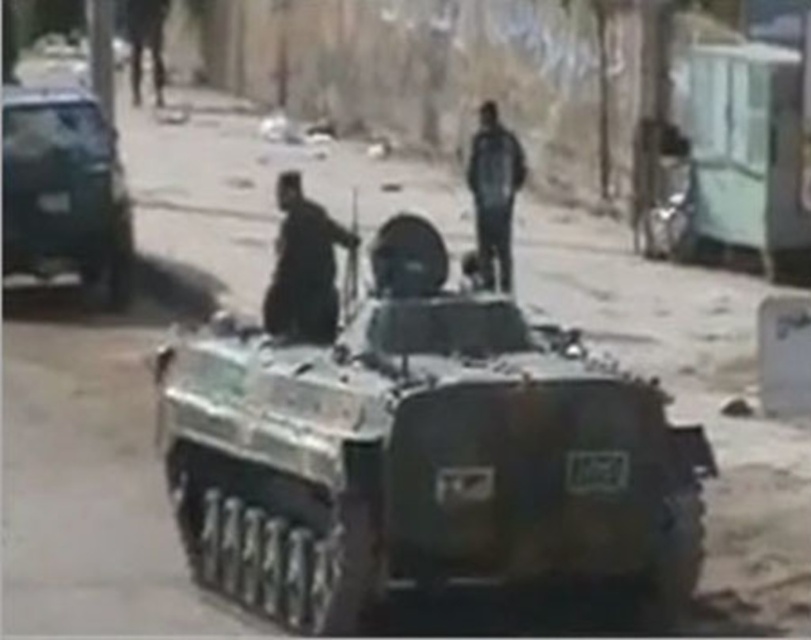
You are a pedestrian trying to cross the street where the shiny black car at left and the dark blue fabric jacket at center are located. Based on their positions, which object is closer to you as you approach from the front of the street?

The shiny black car at left is closer to you because the dark blue fabric jacket at center is behind it.

You are a pedestrian on the street and see the shiny black car at left and the dark blue fabric jacket at center. Which object is closer to your right side?

The dark blue fabric jacket at center is closer to your right side because the shiny black car at left is to the left of dark blue fabric jacket at center.

You are a drone operator trying to identify two points on an armored personnel carrier. You see point at location [466,328] and point at [24,253]. Which point is nearer to you?

Point at location [466,328] is closer to the viewer than point at [24,253].